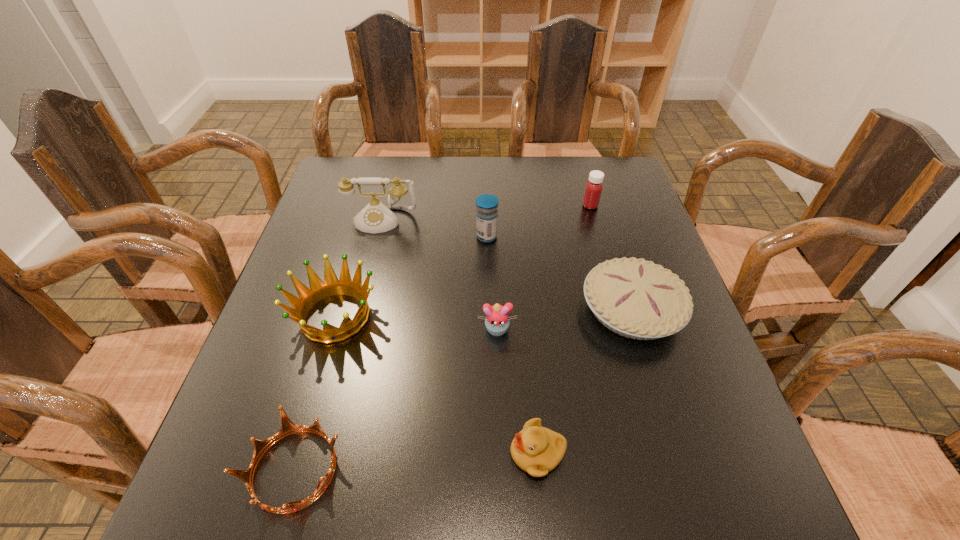
Where is `vacant space at the far right corner of the desktop`? The height and width of the screenshot is (540, 960). vacant space at the far right corner of the desktop is located at coordinates (620, 160).

The image size is (960, 540). I want to click on free space that is in between the duckling and the left medicine, so click(512, 345).

You are a GUI agent. You are given a task and a screenshot of the screen. Output one action in this format:
    pyautogui.click(x=<x>, y=<y>)
    Task: Click on the empty location between the shorter crown and the farther medicine
    The height and width of the screenshot is (540, 960).
    Given the screenshot: What is the action you would take?
    pyautogui.click(x=443, y=338)

Find the location of a particular element. Image resolution: width=960 pixels, height=540 pixels. free space between the telephone and the left medicine is located at coordinates (434, 228).

At what (x,y) coordinates should I click in order to perform the action: click on free space between the cupcake and the duckling. Please return your answer as a coordinate pair (x, y). This screenshot has width=960, height=540. Looking at the image, I should click on (517, 391).

The height and width of the screenshot is (540, 960). I want to click on free space between the farther medicine and the farther crown, so click(463, 261).

Locate an element on the screen. vacant space in between the farther medicine and the cupcake is located at coordinates (543, 267).

Identify the location of empty space between the left medicine and the duckling. pos(512,345).

You are a GUI agent. You are given a task and a screenshot of the screen. Output one action in this format:
    pyautogui.click(x=<x>, y=<y>)
    Task: Click on the free area in between the pie and the farther crown
    This screenshot has height=540, width=960.
    Given the screenshot: What is the action you would take?
    point(484,313)

Where is `empty space between the cupcake and the farther crown`? Image resolution: width=960 pixels, height=540 pixels. empty space between the cupcake and the farther crown is located at coordinates (416, 322).